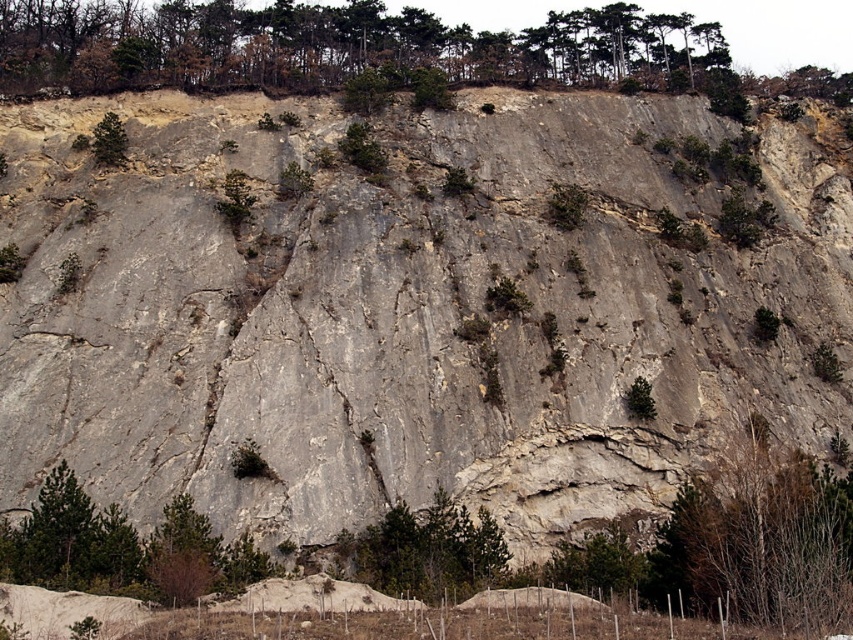
Does green leafy trees at upper center appear on the right side of green leafy tree at center?

No, green leafy trees at upper center is not to the right of green leafy tree at center.

Does point (693, 49) lie in front of point (434, 588)?

No, it is not.

Between point (54, 4) and point (412, 557), which one is positioned behind?

The point (54, 4) is more distant.

Image resolution: width=853 pixels, height=640 pixels. I want to click on green leafy trees at upper center, so click(332, 45).

Does green leafy tree at center appear over green matte tree at upper left?

Actually, green leafy tree at center is below green matte tree at upper left.

Identify the location of green leafy tree at center. This screenshot has height=640, width=853. (427, 550).

Find the location of a particular element. The height and width of the screenshot is (640, 853). green leafy tree at center is located at coordinates (427, 550).

Does green leafy trees at upper center have a larger size compared to green matte tree at upper left?

Yes.

Between point (250, 58) and point (97, 138), which one is positioned in front?

Point (97, 138)

Where is `green leafy trees at upper center`? This screenshot has height=640, width=853. green leafy trees at upper center is located at coordinates (332, 45).

I want to click on green leafy trees at upper center, so click(x=332, y=45).